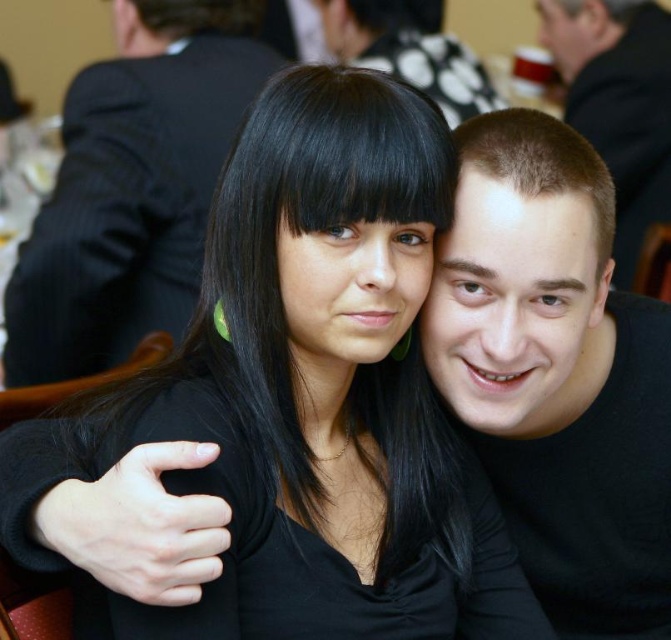
Does black matte shirt at center have a lesser height compared to black matte suit at upper left?

Correct, black matte shirt at center is not as tall as black matte suit at upper left.

Between point (619, 515) and point (113, 243), which one is positioned behind?

Point (113, 243)

At what (x,y) coordinates should I click in order to perform the action: click on black matte shirt at center. Please return your answer as a coordinate pair (x, y). The image size is (671, 640). Looking at the image, I should click on (558, 372).

Is black matte shirt at center below smooth black shirt at center?

Indeed, black matte shirt at center is positioned under smooth black shirt at center.

Which is more to the right, black matte shirt at center or smooth black shirt at center?

Positioned to the right is smooth black shirt at center.

Which is behind, point (609, 442) or point (623, 164)?

Positioned behind is point (623, 164).

I want to click on black matte shirt at center, so click(558, 372).

Looking at this image, which is more to the left, black matte suit at upper left or smooth black shirt at center?

black matte suit at upper left

Between point (178, 321) and point (643, 138), which one is positioned behind?

The point (643, 138) is more distant.

Locate an element on the screen. The width and height of the screenshot is (671, 640). black matte suit at upper left is located at coordinates (134, 186).